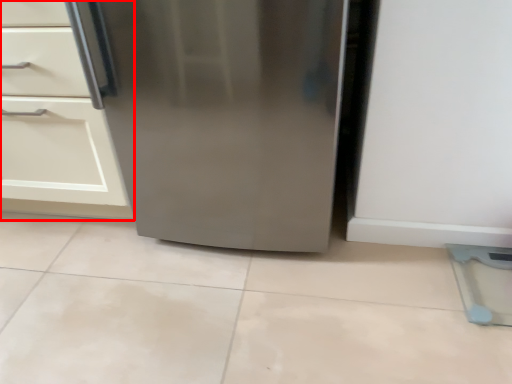
Question: From the image's perspective, where is cabinetry (annotated by the red box) located in relation to refrigerator in the image?

Choices:
 (A) above
 (B) below

Answer: (A)